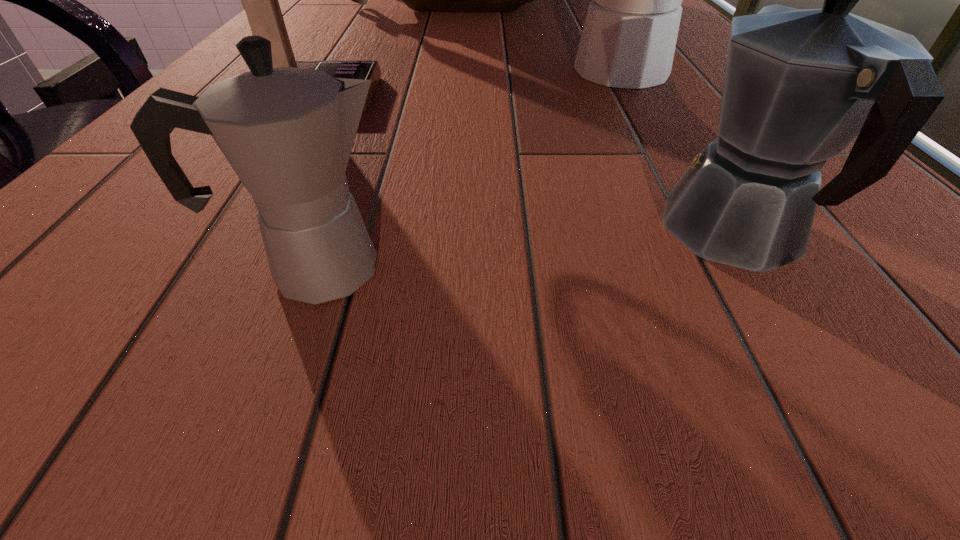
The image size is (960, 540). Identify the location of fan. (260, 0).

What are the coordinates of `the third shortest object` in the screenshot? It's located at (628, 40).

At what (x,y) coordinates should I click in order to perform the action: click on the farthest coffeepot. Please return your answer as a coordinate pair (x, y). Image resolution: width=960 pixels, height=540 pixels. Looking at the image, I should click on (628, 40).

Image resolution: width=960 pixels, height=540 pixels. I want to click on the leftmost coffeepot, so click(x=287, y=132).

Where is `free spot located 0.120m on the front-facing side of the fan`? free spot located 0.120m on the front-facing side of the fan is located at coordinates (465, 94).

Identify the location of free spot located 0.250m at the spout of the third shortest object. (413, 71).

I want to click on blank space located 0.150m at the spout of the third shortest object, so click(470, 71).

This screenshot has height=540, width=960. I want to click on vacant space located 0.400m at the spout of the third shortest object, so click(x=326, y=71).

Locate an element on the screen. The width and height of the screenshot is (960, 540). free space located on the right of the leftmost coffeepot is located at coordinates pyautogui.click(x=513, y=270).

What are the coordinates of `object present at the left edge` in the screenshot? It's located at (260, 0).